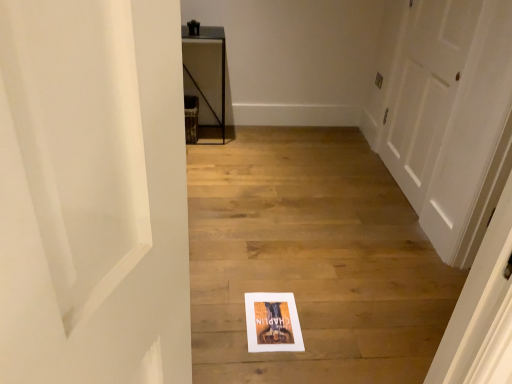
What do you see at coordinates (272, 323) in the screenshot?
I see `matte paper picture frame at center` at bounding box center [272, 323].

The width and height of the screenshot is (512, 384). Identify the location of matte paper picture frame at center. (272, 323).

Where is `matte paper picture frame at center`? The image size is (512, 384). matte paper picture frame at center is located at coordinates (272, 323).